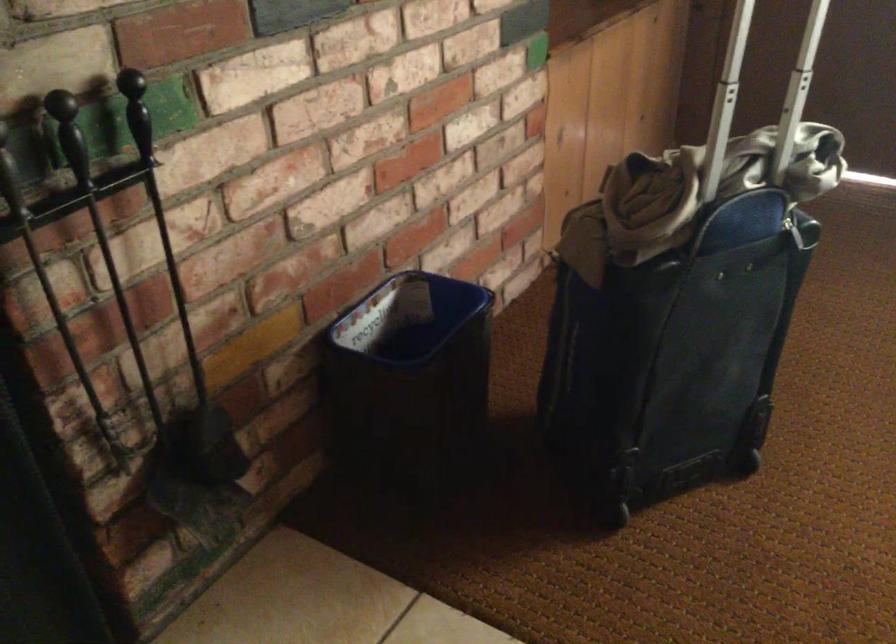
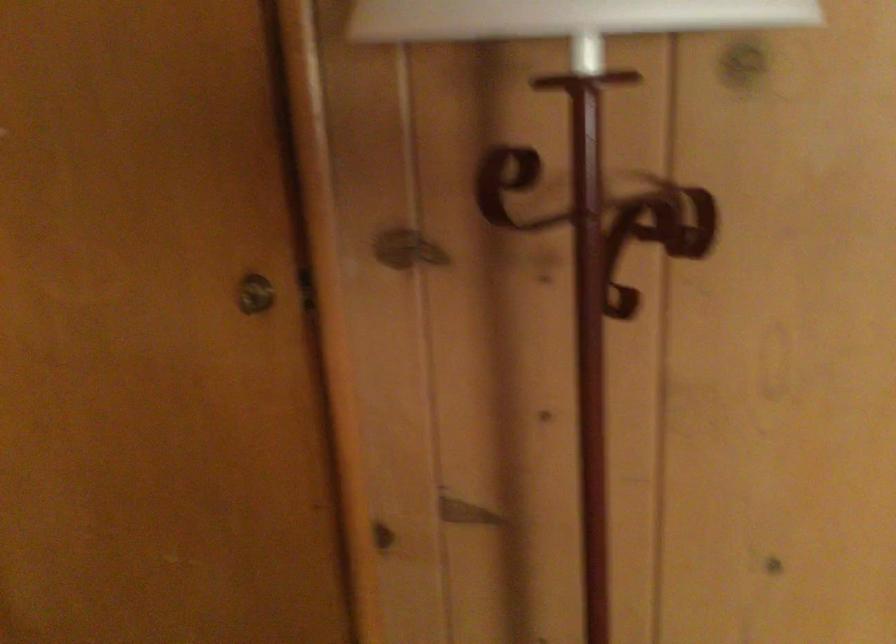
Based on the photo, how did the camera likely rotate?

The camera rotated toward left-down.